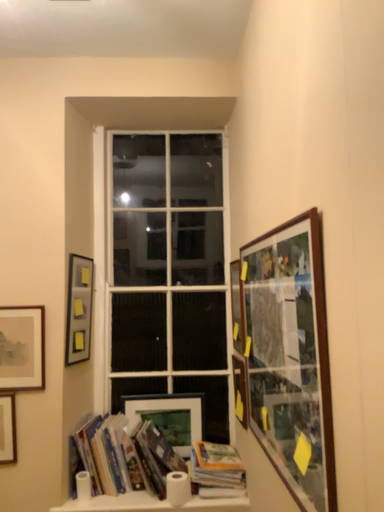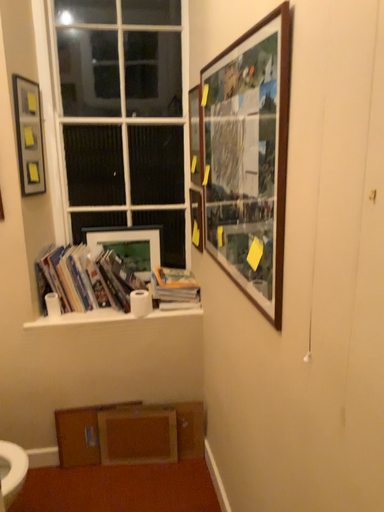
Question: How did the camera likely rotate when shooting the video?

Choices:
 (A) rotated right
 (B) rotated left

Answer: (A)